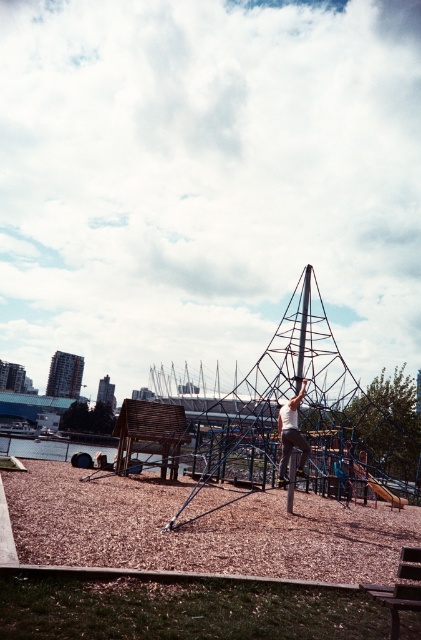
You are a photographer setting up a shot of the playground scene. You want to ensure that the wooden park bench at lower right and the white matte shirt at center are both visible in the frame. Based on their positions, which object should appear higher in your photo?

The wooden park bench at lower right appears higher in the photo because it is positioned above the white matte shirt at center according to the description.